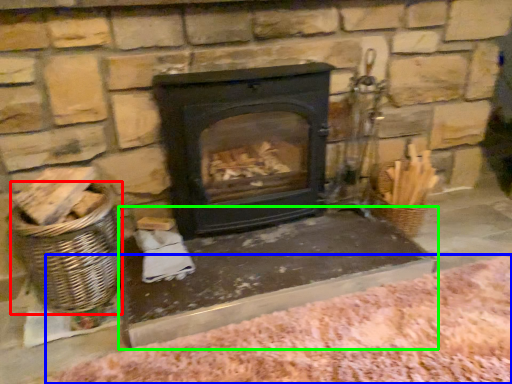
Question: Which is farther away from basket (highlighted by a red box)? blanket (highlighted by a blue box) or table (highlighted by a green box)?

Choices:
 (A) blanket
 (B) table

Answer: (A)